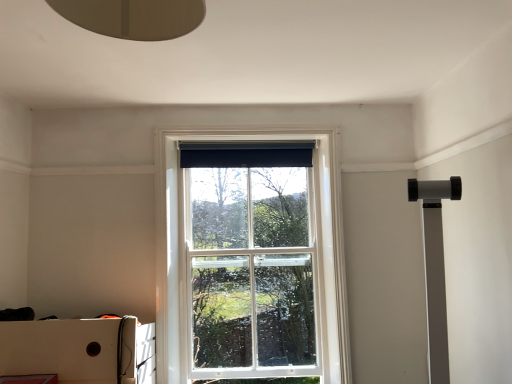
Question: Is white glass window at center at the back of white cardboard box at lower left?

Choices:
 (A) no
 (B) yes

Answer: (A)

Question: Can you confirm if white cardboard box at lower left is taller than white glass window at center?

Choices:
 (A) no
 (B) yes

Answer: (A)

Question: Is white cardboard box at lower left positioned before white glass window at center?

Choices:
 (A) yes
 (B) no

Answer: (A)

Question: Is white cardboard box at lower left at the right side of white glass window at center?

Choices:
 (A) no
 (B) yes

Answer: (A)

Question: Can you confirm if white cardboard box at lower left is smaller than white glass window at center?

Choices:
 (A) no
 (B) yes

Answer: (A)

Question: Relative to black fabric curtain at upper center, is white glass window at center in front or behind?

Choices:
 (A) behind
 (B) front

Answer: (B)

Question: Is point [x=192, y=309] closer or farther from the camera than point [x=266, y=165]?

Choices:
 (A) closer
 (B) farther

Answer: (A)

Question: Considering the positions of white glass window at center and black fabric curtain at upper center in the image, is white glass window at center taller or shorter than black fabric curtain at upper center?

Choices:
 (A) tall
 (B) short

Answer: (A)

Question: In the image, is white glass window at center on the left side or the right side of black fabric curtain at upper center?

Choices:
 (A) left
 (B) right

Answer: (A)

Question: Considering the positions of point (159, 294) and point (116, 324), is point (159, 294) closer or farther from the camera than point (116, 324)?

Choices:
 (A) farther
 (B) closer

Answer: (A)

Question: Looking at their shapes, would you say white glass window at center is wider or thinner than white cardboard box at lower left?

Choices:
 (A) thin
 (B) wide

Answer: (A)

Question: Considering their positions, is white glass window at center located in front of or behind white cardboard box at lower left?

Choices:
 (A) behind
 (B) front

Answer: (A)

Question: In terms of size, does white glass window at center appear bigger or smaller than white cardboard box at lower left?

Choices:
 (A) big
 (B) small

Answer: (B)

Question: Considering the positions of black fabric curtain at upper center and white glass window at center in the image, is black fabric curtain at upper center taller or shorter than white glass window at center?

Choices:
 (A) tall
 (B) short

Answer: (B)

Question: Does point (301, 155) appear closer or farther from the camera than point (181, 134)?

Choices:
 (A) farther
 (B) closer

Answer: (A)